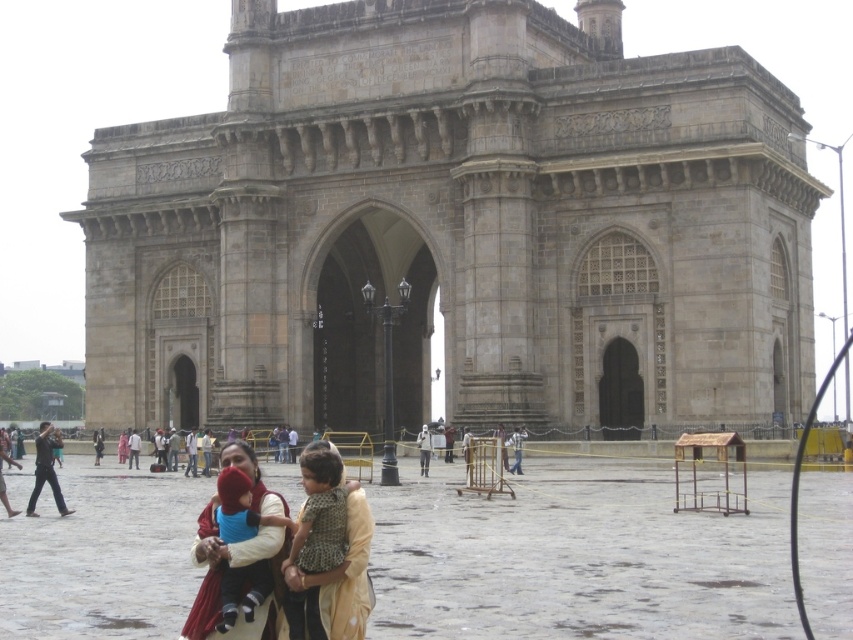
Can you confirm if brown textured dress at center is thinner than matte blue fabric at center?

Correct, brown textured dress at center's width is less than matte blue fabric at center's.

Is brown textured dress at center behind matte blue fabric at center?

That is True.

Is point (310, 556) farther from viewer compared to point (265, 515)?

No, it is in front of (265, 515).

Where is `brown textured dress at center`? brown textured dress at center is located at coordinates (320, 516).

Is matte blue fabric at center behind dark brown leather jacket at center?

No, it is in front of dark brown leather jacket at center.

Can you confirm if matte blue fabric at center is smaller than dark brown leather jacket at center?

No, matte blue fabric at center is not smaller than dark brown leather jacket at center.

Between point (225, 497) and point (170, 426), which one is positioned behind?

Positioned behind is point (170, 426).

Locate an element on the screen. The height and width of the screenshot is (640, 853). matte blue fabric at center is located at coordinates (239, 508).

The height and width of the screenshot is (640, 853). What do you see at coordinates (454, 227) in the screenshot?
I see `stone gateway of india at center` at bounding box center [454, 227].

Who is higher up, stone gateway of india at center or beige fabric dress at center?

stone gateway of india at center is higher up.

In order to click on stone gateway of india at center in this screenshot , I will do `click(454, 227)`.

Find the location of a particular element. The height and width of the screenshot is (640, 853). stone gateway of india at center is located at coordinates (454, 227).